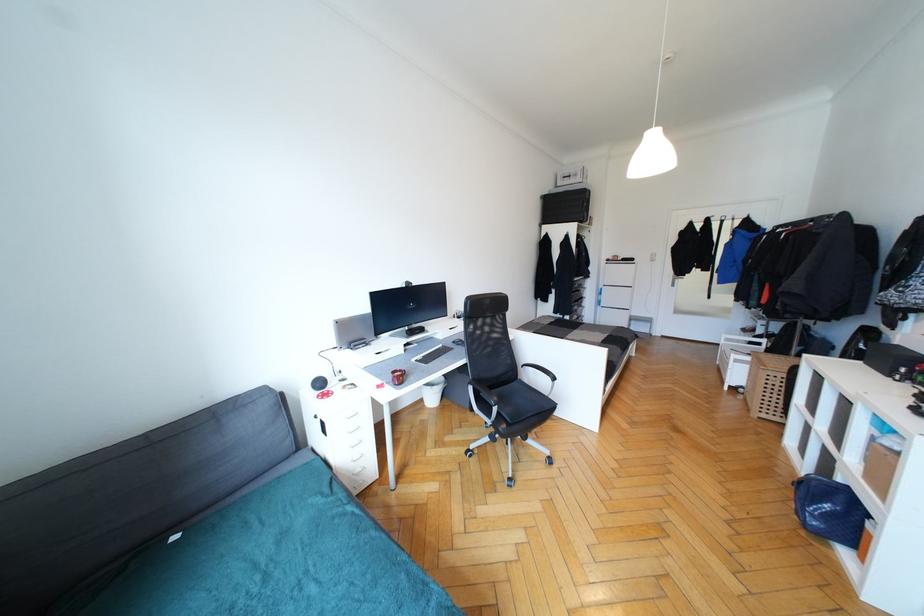
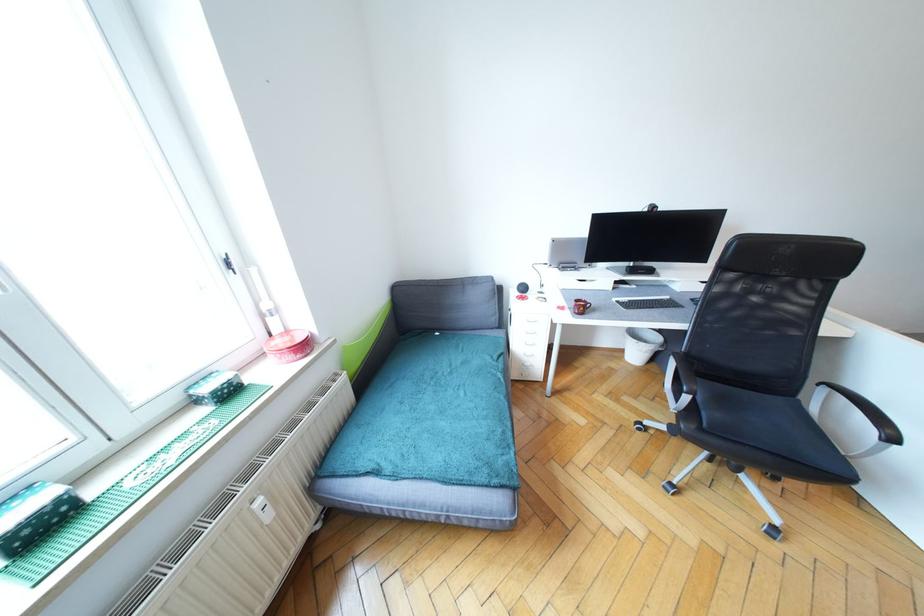
The point at (556, 379) is marked in the first image. Where is the corresponding point in the second image?

(896, 440)